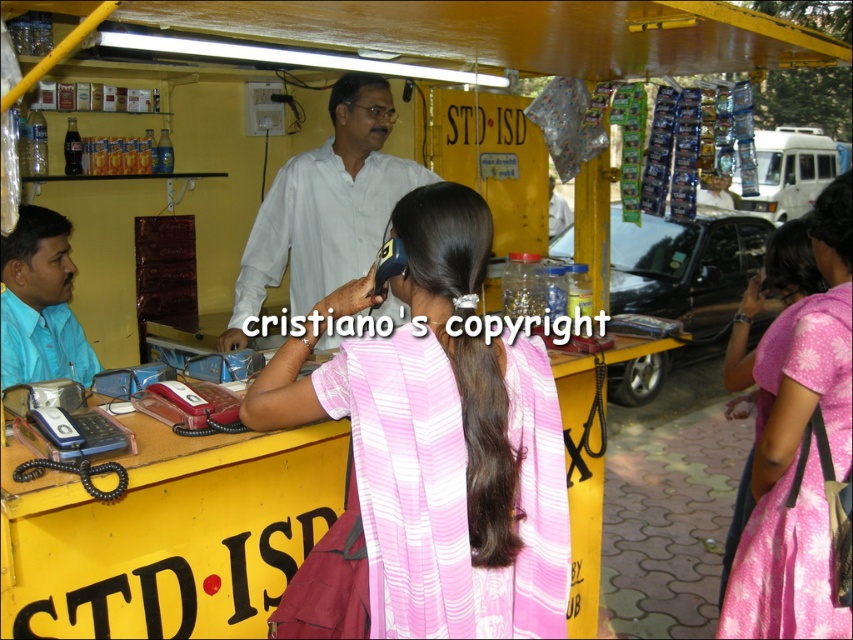
In the scene shown: Can you confirm if white matte shirt at center is smaller than pink satin dress at right?

Correct, white matte shirt at center occupies less space than pink satin dress at right.

Does white matte shirt at center have a larger size compared to pink satin dress at right?

Actually, white matte shirt at center might be smaller than pink satin dress at right.

Find the location of a particular element. This screenshot has width=853, height=640. white matte shirt at center is located at coordinates (325, 205).

The height and width of the screenshot is (640, 853). In order to click on white matte shirt at center in this screenshot , I will do `click(325, 205)`.

Who is more forward, [376,516] or [355,83]?

Point [376,516] is in front.

Between pink striped dress at center and brown matte hair at center, which one is positioned higher?

brown matte hair at center

Is point (339, 588) positioned in front of point (329, 116)?

Yes.

Find the location of a particular element. pink striped dress at center is located at coordinates (431, 458).

Is point (474, 198) farther from camera compared to point (726, 410)?

That is False.

Does pink striped dress at center have a lesser width compared to pink satin dress at right?

Incorrect, pink striped dress at center's width is not less than pink satin dress at right's.

Consider the image. Who is more distant from viewer, (393,522) or (781,268)?

Positioned behind is point (781,268).

Find the location of a particular element. The height and width of the screenshot is (640, 853). pink striped dress at center is located at coordinates (431, 458).